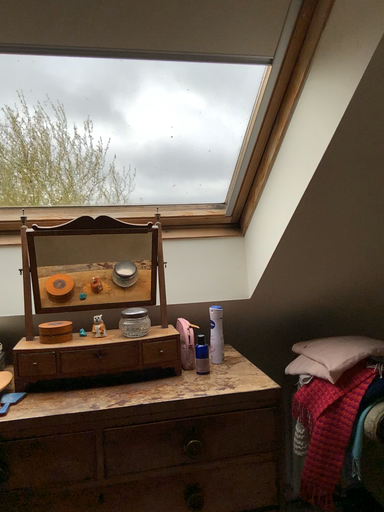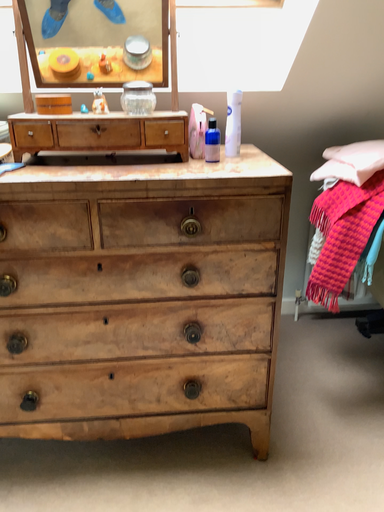
Question: Which way did the camera rotate in the video?

Choices:
 (A) rotated left
 (B) rotated right

Answer: (A)